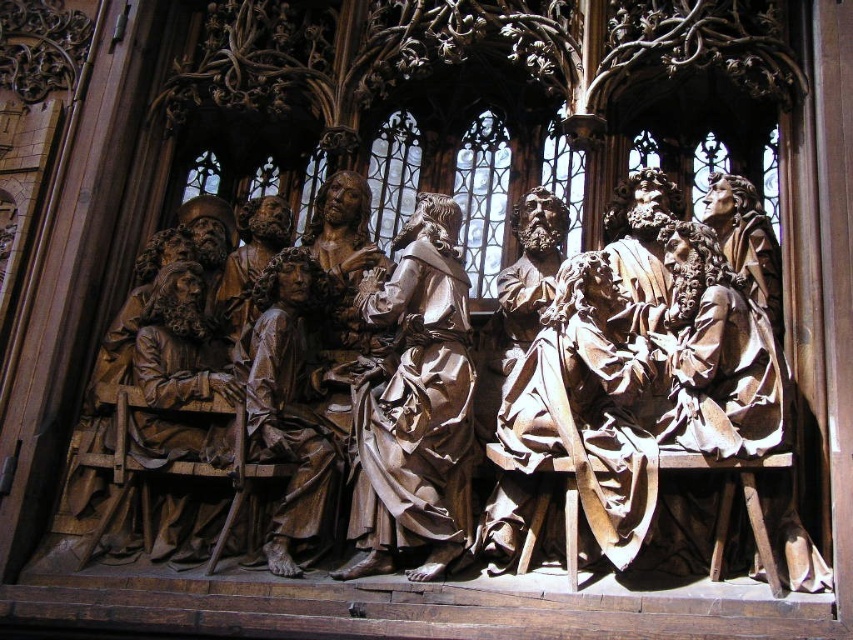
You are standing in the cathedral and want to take a closer look at the sculptures. Which one, the brown wood carving of figures at center or the brown polished wood statue at center, is nearer to you?

The brown wood carving of figures at center is closer to the viewer than the brown polished wood statue at center.

You are an art conservator examining the sculpture in the church. You need to clean both the polished wood figure at center and the brown polished wood statue at center. Which one should you start with if you want to work from front to back?

You should start with the polished wood figure at center first because the brown polished wood statue at center is behind it, so working from front to back would require starting with the one in front.